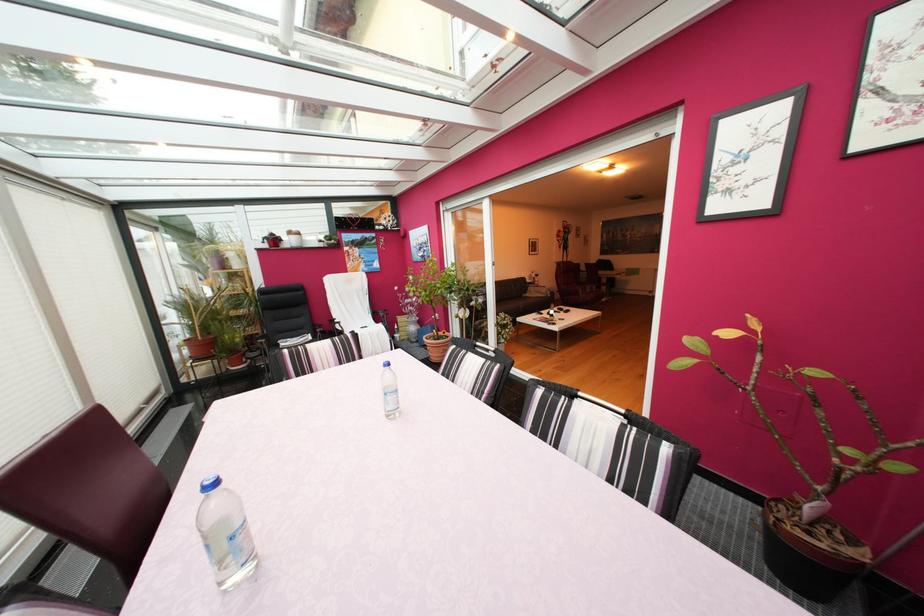
Which object does [809,552] point to?

This point indicates the brown flower pot.